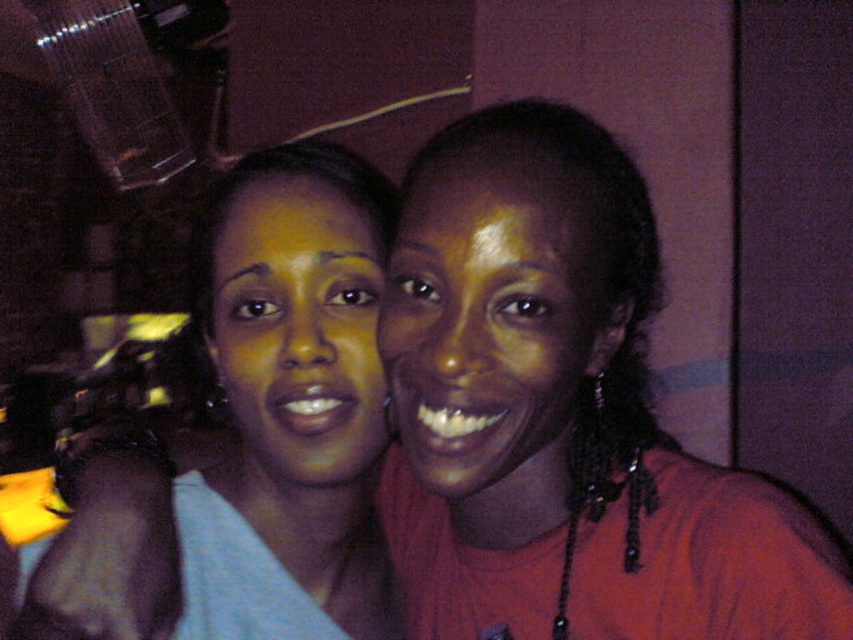
Does matte red shirt at center appear on the left side of matte yellow face at center?

Incorrect, matte red shirt at center is not on the left side of matte yellow face at center.

In the scene shown: Who is more forward, (537, 620) or (265, 227)?

Point (265, 227) is more forward.

Find the location of a particular element. This screenshot has height=640, width=853. matte red shirt at center is located at coordinates (561, 413).

The width and height of the screenshot is (853, 640). What do you see at coordinates (260, 432) in the screenshot?
I see `matte blue shirt at left` at bounding box center [260, 432].

Which is behind, point (213, 344) or point (426, 454)?

The point (213, 344) is behind.

Is point (329, 193) positioned in front of point (479, 268)?

No.

At what (x,y) coordinates should I click in order to perform the action: click on matte blue shirt at left. Please return your answer as a coordinate pair (x, y). This screenshot has width=853, height=640. Looking at the image, I should click on (260, 432).

Does matte gold face at center appear under matte yellow face at center?

Yes.

Who is more distant from viewer, (544, 193) or (349, 301)?

The point (349, 301) is more distant.

You are a GUI agent. You are given a task and a screenshot of the screen. Output one action in this format:
    pyautogui.click(x=<x>, y=<y>)
    Task: Click on the matte gold face at center
    The height and width of the screenshot is (640, 853).
    Given the screenshot: What is the action you would take?
    pyautogui.click(x=491, y=323)

Locate an element on the screen. matte gold face at center is located at coordinates (491, 323).